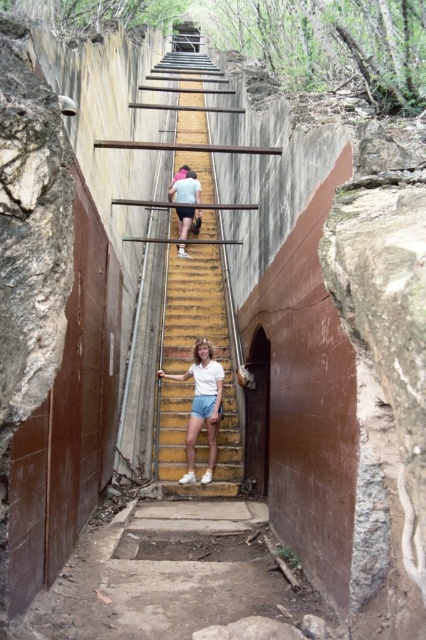
Who is shorter, white cotton shirt at center or white matte shirt at center?

white cotton shirt at center is shorter.

Is point (204, 392) closer to camera compared to point (187, 209)?

Yes.

At what (x,y) coordinates should I click in order to perform the action: click on white cotton shirt at center. Please return your answer as a coordinate pair (x, y). The height and width of the screenshot is (640, 426). Looking at the image, I should click on (201, 404).

Which is more to the left, yellow painted wood stairs at center or white cotton shirt at center?

Positioned to the left is yellow painted wood stairs at center.

Measure the distance between point (x=222, y=298) and camera.

11.60 meters

Locate an element on the screen. The image size is (426, 640). yellow painted wood stairs at center is located at coordinates (203, 337).

Is yellow painted wood stairs at center wider than white matte shirt at center?

Indeed, yellow painted wood stairs at center has a greater width compared to white matte shirt at center.

Between yellow painted wood stairs at center and white matte shirt at center, which one is positioned higher?

yellow painted wood stairs at center is higher up.

Identify the location of yellow painted wood stairs at center. (203, 337).